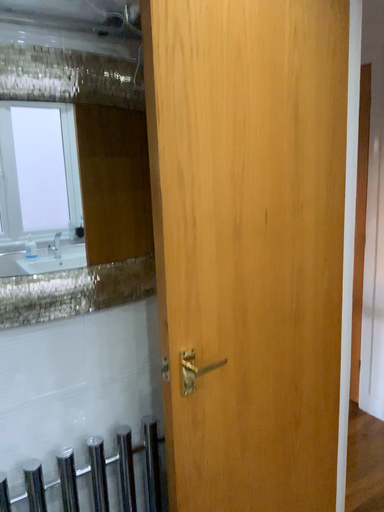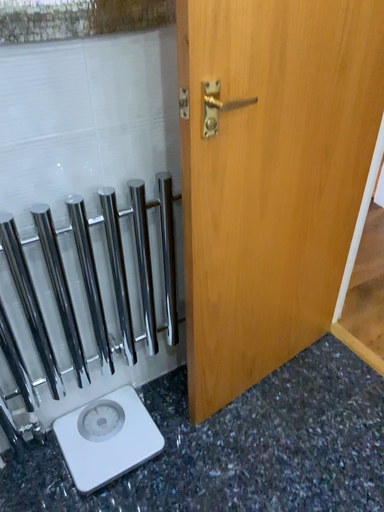
Question: Which way did the camera rotate in the video?

Choices:
 (A) rotated upward
 (B) rotated downward

Answer: (B)